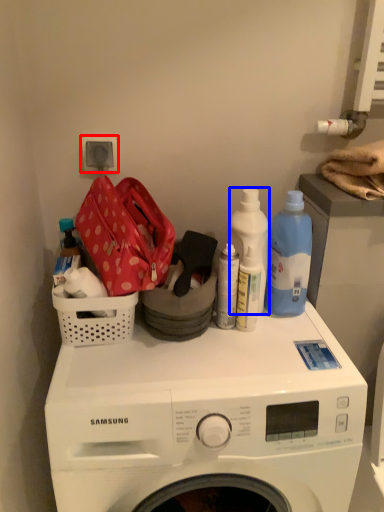
Question: Which object is closer to the camera taking this photo, electric outlet (highlighted by a red box) or cleaning product (highlighted by a blue box)?

Choices:
 (A) electric outlet
 (B) cleaning product

Answer: (B)